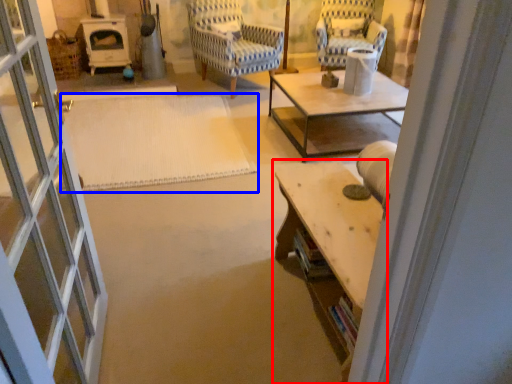
Question: Which point is further to the camera, table (highlighted by a red box) or mat (highlighted by a blue box)?

Choices:
 (A) table
 (B) mat

Answer: (B)